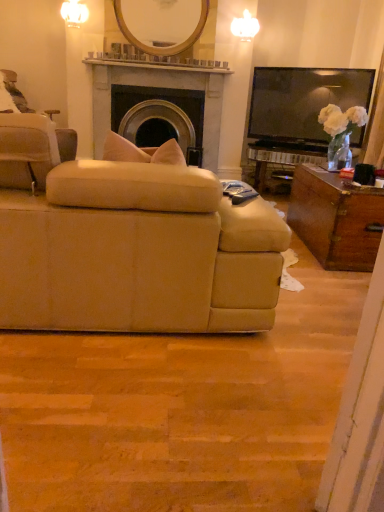
What do you see at coordinates (244, 196) in the screenshot?
I see `black plastic remote control at center` at bounding box center [244, 196].

Image resolution: width=384 pixels, height=512 pixels. In order to click on wooden/matte mirror at upper center in this screenshot , I will do `click(161, 23)`.

Measure the distance between wooden/matte mirror at upper center and camera.

wooden/matte mirror at upper center is 4.03 meters from camera.

This screenshot has height=512, width=384. In order to click on beige fabric chair at left in this screenshot , I will do `click(29, 141)`.

Would you say beige fabric chair at left is a long distance from matte stone fireplace at center?

Yes, beige fabric chair at left is far from matte stone fireplace at center.

Looking at their sizes, would you say beige fabric chair at left is wider or thinner than matte stone fireplace at center?

Clearly, beige fabric chair at left has more width compared to matte stone fireplace at center.

The height and width of the screenshot is (512, 384). What are the coordinates of `chair in front of the matte stone fireplace at center` in the screenshot? It's located at (29, 141).

Looking at their sizes, would you say black plastic remote control at center is wider or thinner than matte stone fireplace at center?

In the image, black plastic remote control at center appears to be more narrow than matte stone fireplace at center.

Is black plastic remote control at center positioned with its back to matte stone fireplace at center?

No, black plastic remote control at center is not facing the opposite direction of matte stone fireplace at center.

Would you consider black plastic remote control at center to be distant from matte stone fireplace at center?

Yes, black plastic remote control at center and matte stone fireplace at center are quite far apart.

From a real-world perspective, between black plastic remote control at center and matte stone fireplace at center, who is vertically lower?

black plastic remote control at center.

In the scene shown: Which is more distant, (196, 86) or (186, 268)?

The point (196, 86) is behind.

Is matte stone fireplace at center taller than beige fabric couch at center?

Indeed, matte stone fireplace at center has a greater height compared to beige fabric couch at center.

Is matte stone fireplace at center outside of beige fabric couch at center?

Yes.

Considering the positions of objects black plastic remote control at center and wooden/matte mirror at upper center in the image provided, who is behind, black plastic remote control at center or wooden/matte mirror at upper center?

wooden/matte mirror at upper center.

Between black plastic remote control at center and wooden/matte mirror at upper center, which one has larger width?

black plastic remote control at center.

Considering the relative sizes of black plastic remote control at center and wooden/matte mirror at upper center in the image provided, is black plastic remote control at center shorter than wooden/matte mirror at upper center?

Yes, black plastic remote control at center is shorter than wooden/matte mirror at upper center.

Between black plastic remote control at center and wooden/matte mirror at upper center, which one has smaller size?

With smaller size is black plastic remote control at center.

Is matte stone fireplace at center wider or thinner than beige fabric chair at left?

Considering their sizes, matte stone fireplace at center looks slimmer than beige fabric chair at left.

From the picture: Between matte stone fireplace at center and beige fabric chair at left, which one is positioned behind?

matte stone fireplace at center is behind.

How different are the orientations of matte stone fireplace at center and beige fabric chair at left in degrees?

59.8 degrees separate the facing orientations of matte stone fireplace at center and beige fabric chair at left.

Is wooden/matte mirror at upper center located outside beige fabric chair at left?

Yes, wooden/matte mirror at upper center is outside of beige fabric chair at left.

Could you tell me if wooden/matte mirror at upper center is facing beige fabric chair at left?

No, wooden/matte mirror at upper center is not oriented towards beige fabric chair at left.

From the image's perspective, is wooden/matte mirror at upper center on beige fabric chair at left?

Yes, from the image's perspective, wooden/matte mirror at upper center is on top of beige fabric chair at left.

In the scene shown: Does wooden/matte mirror at upper center have a lesser width compared to beige fabric chair at left?

Yes.

Considering their positions, is beige fabric couch at center located in front of or behind matte stone fireplace at center?

beige fabric couch at center is positioned closer to the viewer than matte stone fireplace at center.

Are beige fabric couch at center and matte stone fireplace at center located far from each other?

beige fabric couch at center is far away from matte stone fireplace at center.

Which is closer, [74,320] or [96,69]?

Point [74,320] is closer to the camera than point [96,69].

Is beige fabric couch at center shorter than matte stone fireplace at center?

Correct, beige fabric couch at center is not as tall as matte stone fireplace at center.

This screenshot has width=384, height=512. Identify the location of fireplace on the right of beige fabric chair at left. (158, 88).

Locate an element on the screen. The image size is (384, 512). fireplace located on the left of black plastic remote control at center is located at coordinates (158, 88).

Based on their spatial positions, is wooden/matte mirror at upper center or black plastic remote control at center closer to matte stone fireplace at center?

The object closer to matte stone fireplace at center is wooden/matte mirror at upper center.

Which object lies nearer to the anchor point black plastic remote control at center, wooden/matte mirror at upper center or matte stone fireplace at center?

matte stone fireplace at center.

Estimate the real-world distances between objects in this image. Which object is closer to beige fabric couch at center, black plastic remote control at center or wooden/matte mirror at upper center?

black plastic remote control at center.

Based on their spatial positions, is wooden/matte mirror at upper center or black plastic remote control at center further from beige fabric chair at left?

wooden/matte mirror at upper center lies further to beige fabric chair at left than the other object.

Looking at the image, which one is located closer to beige fabric chair at left, beige fabric couch at center or black plastic remote control at center?

Based on the image, beige fabric couch at center appears to be nearer to beige fabric chair at left.

Which object lies further to the anchor point beige fabric couch at center, wooden/matte mirror at upper center or matte stone fireplace at center?

wooden/matte mirror at upper center.

From the image, which object appears to be farther from black plastic remote control at center, matte stone fireplace at center or beige fabric couch at center?

Based on the image, matte stone fireplace at center appears to be further to black plastic remote control at center.

Based on their spatial positions, is matte stone fireplace at center or beige fabric couch at center closer to wooden/matte mirror at upper center?

matte stone fireplace at center is positioned closer to the anchor wooden/matte mirror at upper center.

Locate an element on the screen. This screenshot has height=512, width=384. mirror located between black plastic remote control at center and matte stone fireplace at center in the depth direction is located at coordinates (161, 23).

I want to click on chair positioned between beige fabric couch at center and matte stone fireplace at center from near to far, so click(x=29, y=141).

Where is `chair between black plastic remote control at center and matte stone fireplace at center along the z-axis`? chair between black plastic remote control at center and matte stone fireplace at center along the z-axis is located at coordinates (29, 141).

Locate an element on the screen. remote control between beige fabric couch at center and wooden/matte mirror at upper center in the front-back direction is located at coordinates 244,196.